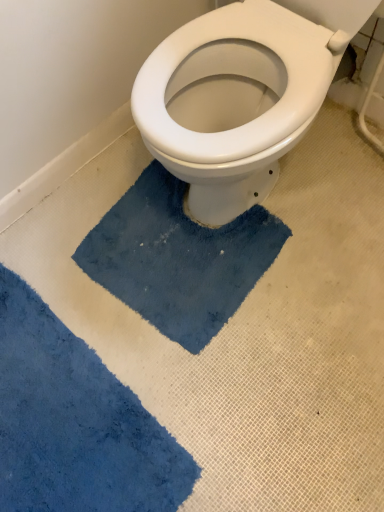
This screenshot has height=512, width=384. In order to click on free space in front of blue plush bath mat at center, which is the first bath mat in top-to-bottom order in this screenshot , I will do `click(197, 407)`.